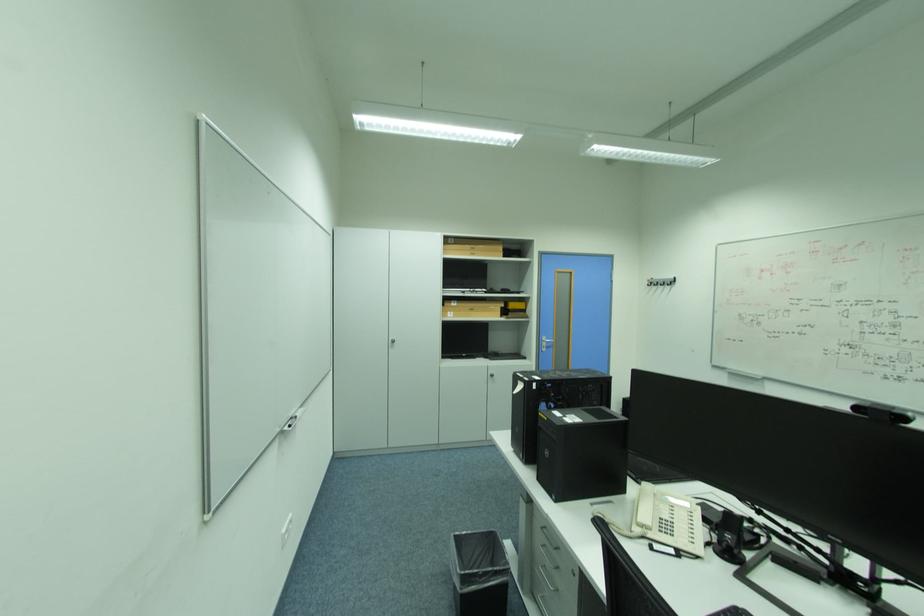
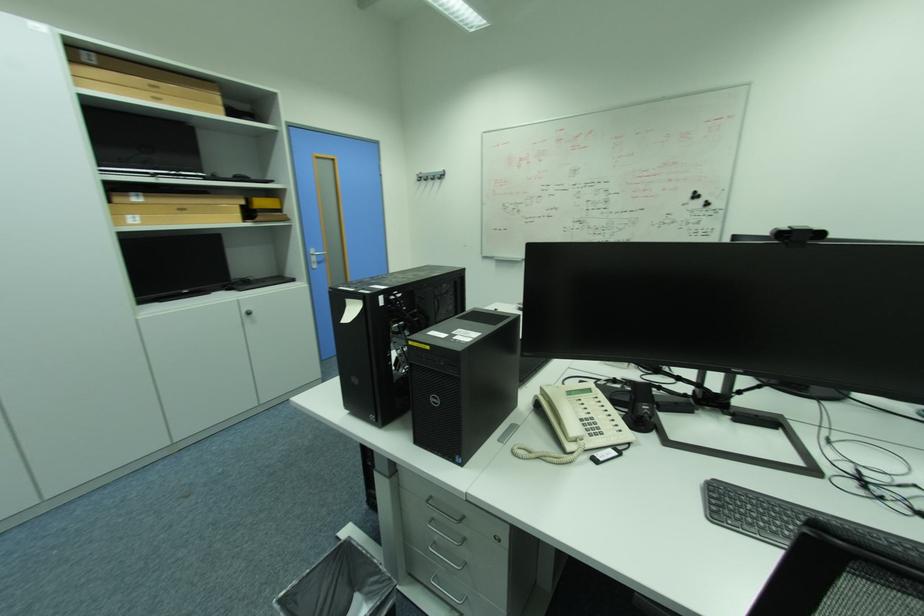
Question: The camera is either moving clockwise (left) or counter-clockwise (right) around the object. The first image is from the beginning of the video and the second image is from the end. Is the camera moving left or right when shooting the video?

Choices:
 (A) Left
 (B) Right

Answer: (A)